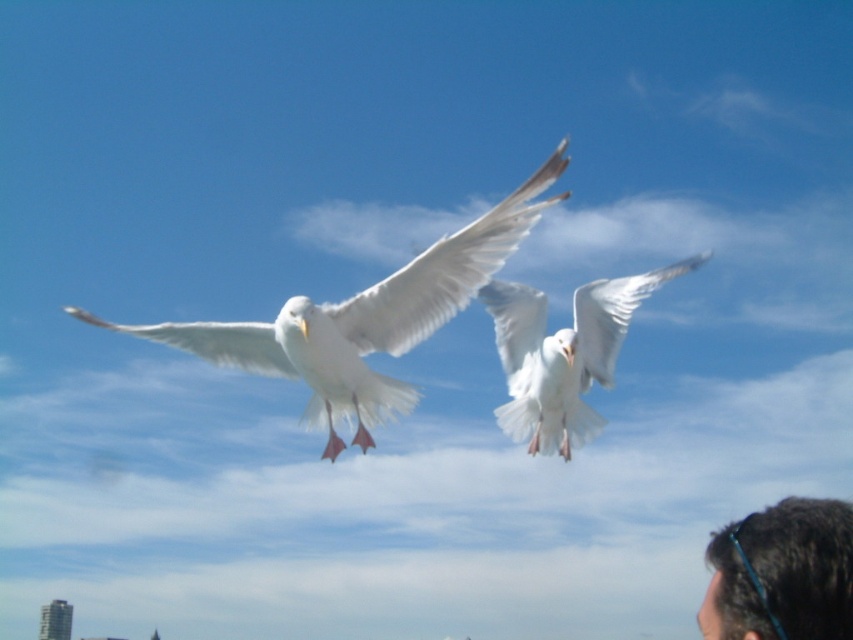
You are a birdwatcher trying to identify two seagulls in the sky. You notice one white feathered bird at center and another white feathered bird at upper center. Which one do you think is closer to you based on their size?

The white feathered bird at center is larger in size than the white feathered bird at upper center, so the bird at center is closer to you since closer objects appear larger.

You are a photographer trying to capture both the white feathered bird at center and the dark brown hair at lower right in the same frame. Based on their sizes in the image, which one should you focus on first to ensure both are in focus?

The white feathered bird at center is larger than the dark brown hair at lower right. To ensure both are in focus, you should focus on the white feathered bird at center first since it requires a smaller depth of field adjustment compared to the smaller dark brown hair at lower right.

You are a photographer trying to capture the white feathered bird at center in your shot. You notice a point at coordinates point (x=364, y=320). Where is this point located relative to the white feathered bird at center?

The point (x=364, y=320) corresponds to the white feathered bird at center, so it is located exactly at the center of the bird.